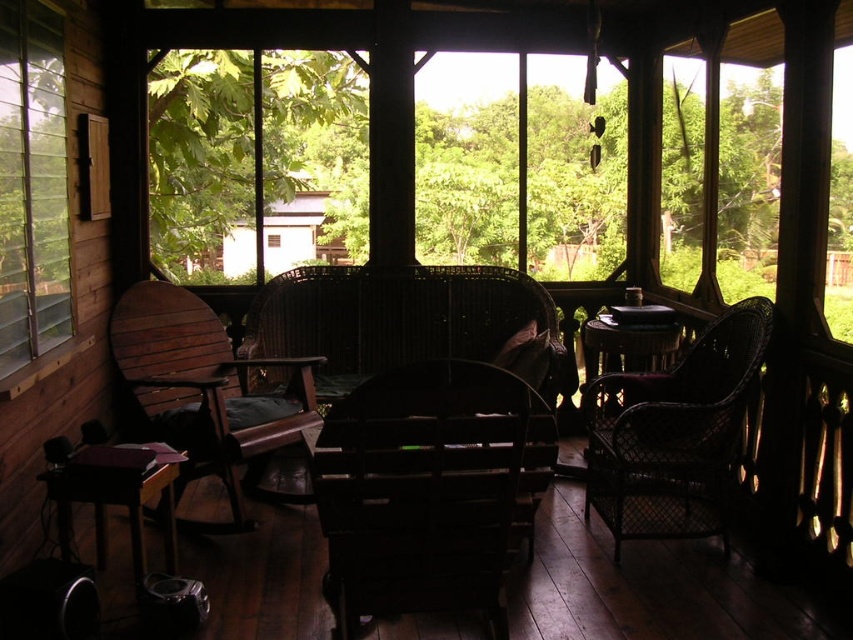
Question: Which object appears farthest from the camera in this image?

Choices:
 (A) woven dark brown chair at right
 (B) wooden armchair at left
 (C) clear glass window at upper left

Answer: (B)

Question: Does dark wood rocking chair at center appear on the right side of clear glass window at upper left?

Choices:
 (A) no
 (B) yes

Answer: (B)

Question: Which is nearer to the dark wood rocking chair at center?

Choices:
 (A) dark brown wicker chair at center
 (B) woven dark brown chair at right
 (C) clear glass window at upper left

Answer: (B)

Question: Which point is farther to the camera?

Choices:
 (A) (724, 365)
 (B) (231, 595)
 (C) (44, 321)
 (D) (210, 310)

Answer: (D)

Question: Does dark wood rocking chair at center have a greater width compared to clear glass window at upper left?

Choices:
 (A) no
 (B) yes

Answer: (B)

Question: Does dark wood rocking chair at center lie in front of woven dark brown chair at right?

Choices:
 (A) yes
 (B) no

Answer: (A)